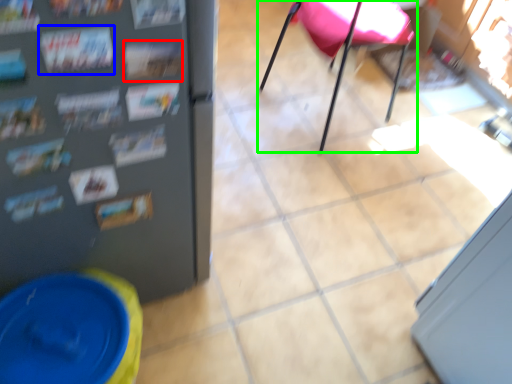
Question: Estimate the real-world distances between objects in this image. Which object is farther from magazine (highlighted by a red box), magazine (highlighted by a blue box) or chair (highlighted by a green box)?

Choices:
 (A) magazine
 (B) chair

Answer: (B)